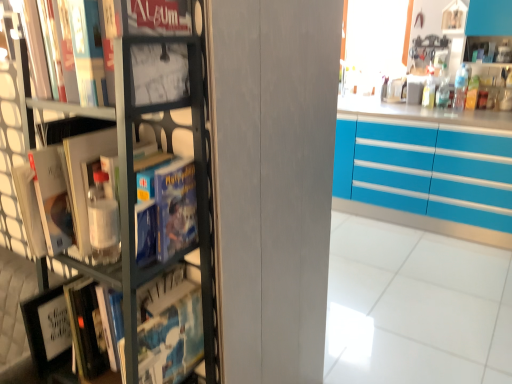
Question: From a real-world perspective, relative to matte black book at upper left, is turquoise glossy cabinets at right vertically above or below?

Choices:
 (A) above
 (B) below

Answer: (B)

Question: Is turquoise glossy cabinets at right taller or shorter than matte black book at upper left?

Choices:
 (A) short
 (B) tall

Answer: (B)

Question: Estimate the real-world distances between objects in this image. Which object is farther from the turquoise glossy cabinets at right?

Choices:
 (A) metallic gray bookcase at left
 (B) matte black book at upper left

Answer: (B)

Question: Considering the real-world distances, which object is closest to the turquoise glossy cabinets at right?

Choices:
 (A) matte black book at upper left
 (B) metallic gray bookcase at left

Answer: (B)